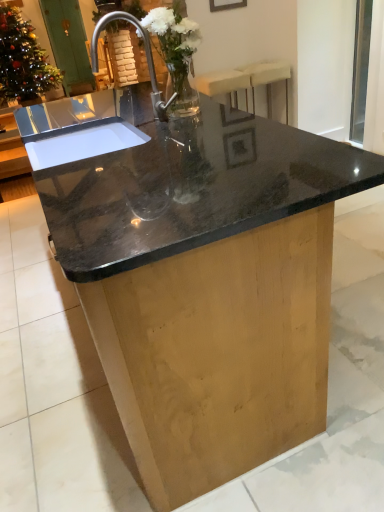
Question: Considering the relative positions of transparent glass window screen at upper right and polished stainless steel sink at center in the image provided, is transparent glass window screen at upper right to the right of polished stainless steel sink at center from the viewer's perspective?

Choices:
 (A) no
 (B) yes

Answer: (B)

Question: From the image's perspective, does transparent glass window screen at upper right appear higher than polished stainless steel sink at center?

Choices:
 (A) yes
 (B) no

Answer: (A)

Question: Can you confirm if transparent glass window screen at upper right is bigger than polished stainless steel sink at center?

Choices:
 (A) no
 (B) yes

Answer: (A)

Question: Does transparent glass window screen at upper right have a lesser width compared to polished stainless steel sink at center?

Choices:
 (A) no
 (B) yes

Answer: (B)

Question: Is the position of transparent glass window screen at upper right less distant than that of polished stainless steel sink at center?

Choices:
 (A) yes
 (B) no

Answer: (B)

Question: Is transparent glass window screen at upper right aimed at polished stainless steel sink at center?

Choices:
 (A) yes
 (B) no

Answer: (B)

Question: Is green wooden screen door at upper left at the back of polished stainless steel sink at center?

Choices:
 (A) yes
 (B) no

Answer: (B)

Question: Does polished stainless steel sink at center appear on the left side of green wooden screen door at upper left?

Choices:
 (A) yes
 (B) no

Answer: (B)

Question: Is the depth of polished stainless steel sink at center less than that of green wooden screen door at upper left?

Choices:
 (A) yes
 (B) no

Answer: (A)

Question: Would you say green wooden screen door at upper left is part of polished stainless steel sink at center's contents?

Choices:
 (A) no
 (B) yes

Answer: (A)

Question: Is polished stainless steel sink at center positioned behind green wooden screen door at upper left?

Choices:
 (A) no
 (B) yes

Answer: (A)

Question: Is polished stainless steel sink at center at the right side of green wooden screen door at upper left?

Choices:
 (A) yes
 (B) no

Answer: (A)

Question: Can you confirm if clear glass vase at center, which is counted as the first floral arrangement, starting from the bottom, is wider than matte black picture frame at upper center?

Choices:
 (A) yes
 (B) no

Answer: (A)